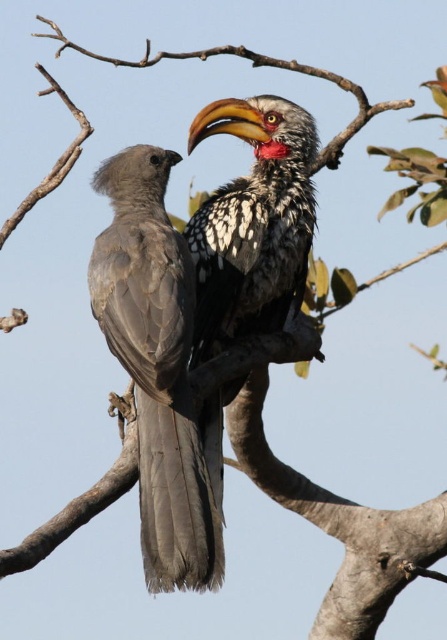
Does gray matte bird at center appear on the left side of speckled feathered hornbill at center?

A: Correct, you'll find gray matte bird at center to the left of speckled feathered hornbill at center.

What do you see at coordinates (156, 365) in the screenshot? I see `gray matte bird at center` at bounding box center [156, 365].

At what (x,y) coordinates should I click in order to perform the action: click on gray matte bird at center. Please return your answer as a coordinate pair (x, y). This screenshot has height=640, width=447. Looking at the image, I should click on (156, 365).